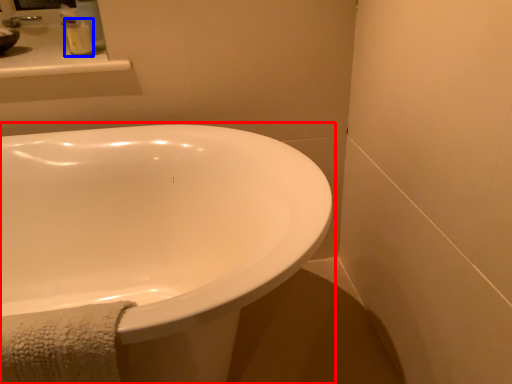
Question: Which of the following is the farthest to the observer, bathtub (highlighted by a red box) or soap dispenser (highlighted by a blue box)?

Choices:
 (A) bathtub
 (B) soap dispenser

Answer: (B)